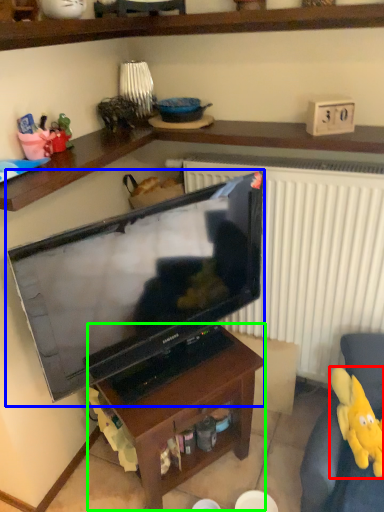
Question: Which object is positioned closest to toy (highlighted by a red box)? Select from television (highlighted by a blue box) and table (highlighted by a green box).

Choices:
 (A) television
 (B) table

Answer: (B)